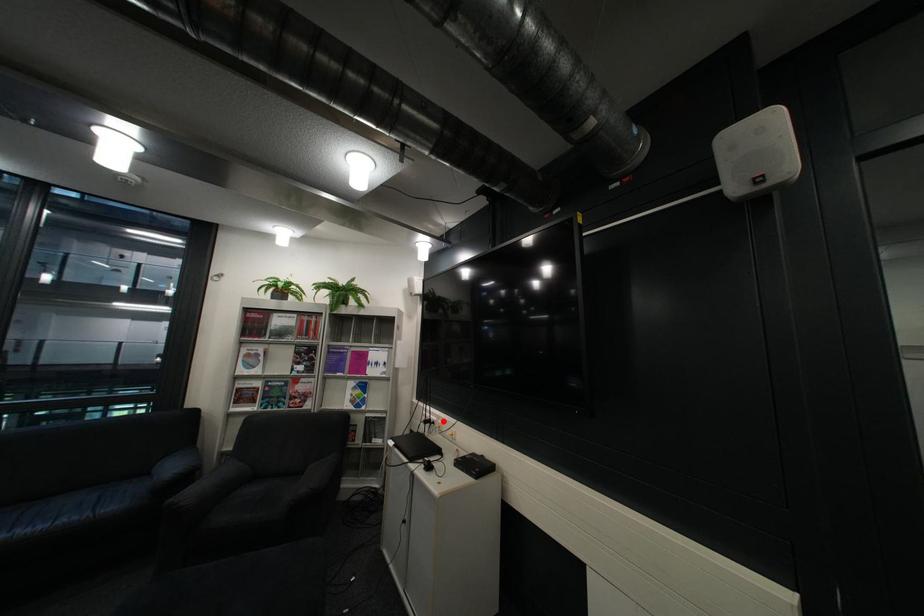
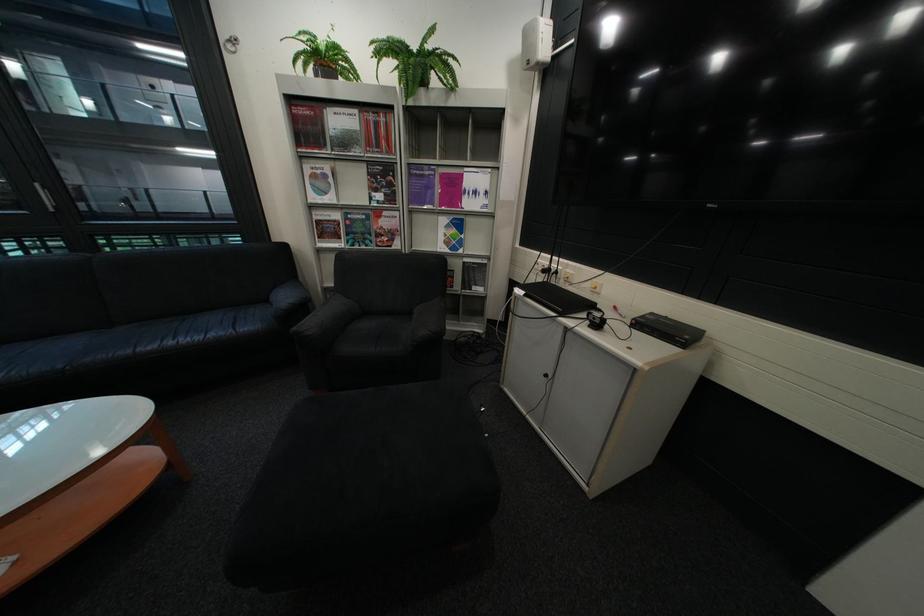
Question: I am providing you with two images of the same scene from different viewpoints. Image1 has a red point marked. In image2, the corresponding 3D location appears at what relative position? Reply with the corresponding letter.

Choices:
 (A) Closer
 (B) Farther

Answer: (A)